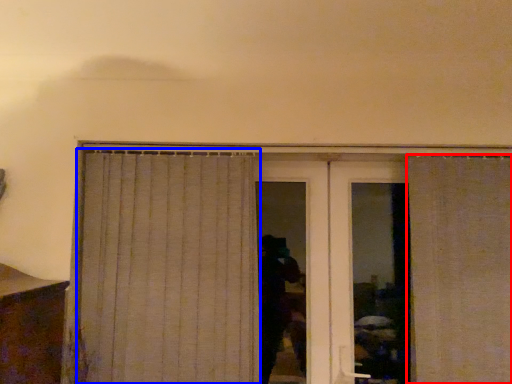
Question: Which point is closer to the camera, curtain (highlighted by a red box) or curtain (highlighted by a blue box)?

Choices:
 (A) curtain
 (B) curtain

Answer: (A)